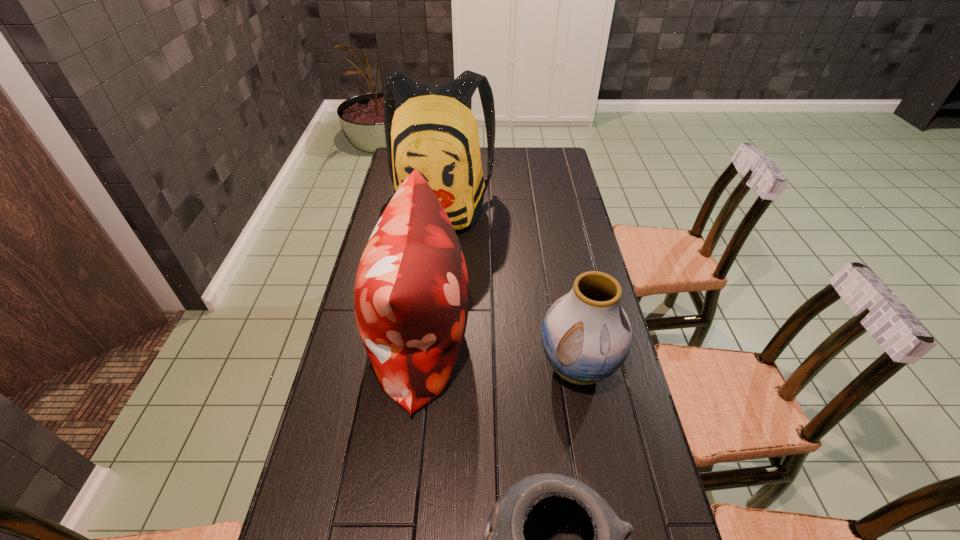
Find the location of a particular element. This screenshot has height=540, width=960. the farthest object is located at coordinates (430, 128).

The width and height of the screenshot is (960, 540). Find the location of `the second tallest object`. the second tallest object is located at coordinates (411, 298).

You are a GUI agent. You are given a task and a screenshot of the screen. Output one action in this format:
    pyautogui.click(x=<x>, y=<y>)
    Task: Click on the vase
    Image resolution: width=960 pixels, height=540 pixels.
    Given the screenshot: What is the action you would take?
    pyautogui.click(x=586, y=335)

The width and height of the screenshot is (960, 540). In order to click on vacant space located 0.270m on the front-facing side of the farthest object in this screenshot , I will do `click(431, 299)`.

Locate an element on the screen. vacant space positioned on the front-facing side of the cushion is located at coordinates (536, 343).

The height and width of the screenshot is (540, 960). I want to click on vacant space located 0.220m on the left of the second shortest object, so click(457, 367).

This screenshot has width=960, height=540. Find the location of `backpack located in the left edge section of the desktop`. backpack located in the left edge section of the desktop is located at coordinates (430, 128).

Where is `cushion at the left edge`? This screenshot has height=540, width=960. cushion at the left edge is located at coordinates (411, 298).

Locate an element on the screen. The height and width of the screenshot is (540, 960). object that is at the right edge is located at coordinates (586, 335).

In the image, there is a desktop. Where is `vacant space at the left edge`? The height and width of the screenshot is (540, 960). vacant space at the left edge is located at coordinates (345, 523).